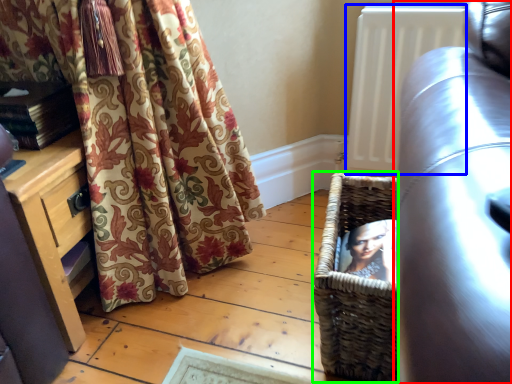
Question: Which object is the farthest from studio couch (highlighted by a red box)? Choose among these: radiator (highlighted by a blue box) or basket (highlighted by a green box).

Choices:
 (A) radiator
 (B) basket

Answer: (A)